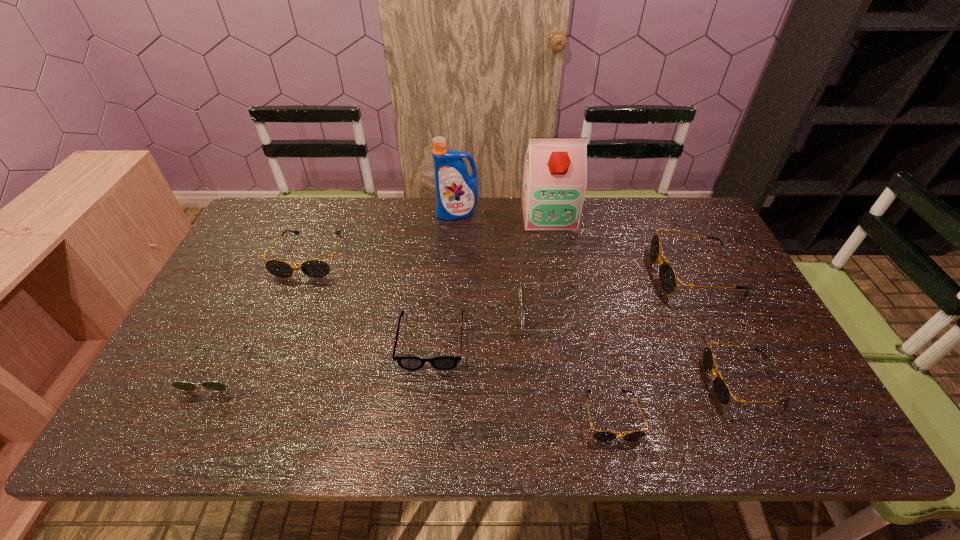
Locate an element on the screen. free space located on the front-facing side of the farther green sunglasses is located at coordinates (444, 314).

Where is `free point located 0.140m on the front-facing side of the farther green sunglasses`? This screenshot has width=960, height=540. free point located 0.140m on the front-facing side of the farther green sunglasses is located at coordinates (468, 314).

What are the coordinates of `vacant region located 0.390m on the front-facing side of the third biggest black sunglasses` in the screenshot? It's located at 544,382.

Where is `free space located on the front-facing side of the third biggest black sunglasses`? free space located on the front-facing side of the third biggest black sunglasses is located at coordinates (670, 382).

Locate an element on the screen. The width and height of the screenshot is (960, 540). free location located 0.100m on the front-facing side of the third biggest black sunglasses is located at coordinates (665, 382).

This screenshot has height=540, width=960. Find the location of `vacant space located 0.140m on the arms of the black spectacles`. vacant space located 0.140m on the arms of the black spectacles is located at coordinates (423, 424).

Find the location of `free space located on the front-facing side of the nearer green sunglasses`. free space located on the front-facing side of the nearer green sunglasses is located at coordinates (181, 437).

Find the location of a particular element. The height and width of the screenshot is (540, 960). soya milk present at the far edge is located at coordinates (555, 169).

Where is `detergent that is at the far edge`? Image resolution: width=960 pixels, height=540 pixels. detergent that is at the far edge is located at coordinates (456, 191).

This screenshot has width=960, height=540. What are the coordinates of `sunglasses present at the far edge` in the screenshot? It's located at (315, 268).